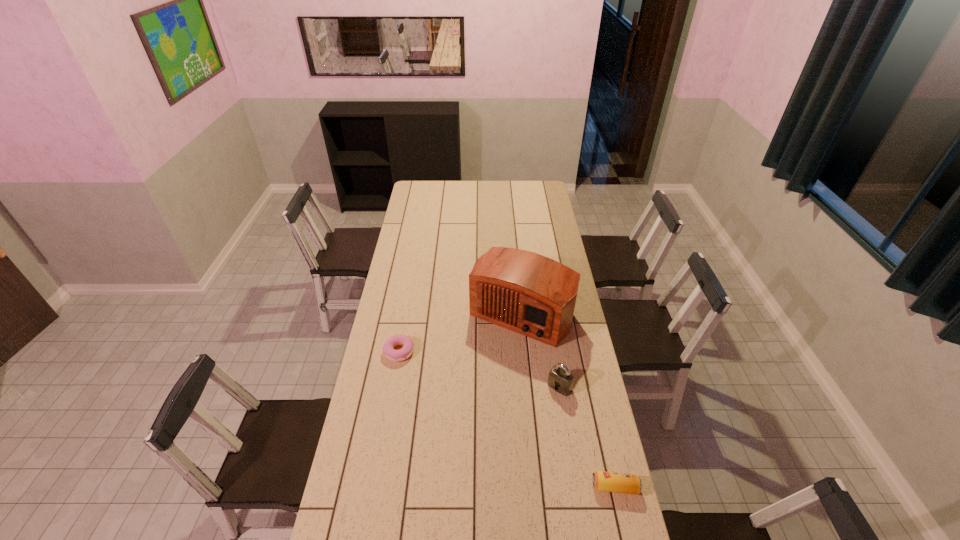
Identify the location of vacant space located on the front-facing side of the tallest object. The height and width of the screenshot is (540, 960). (470, 387).

At what (x,y) coordinates should I click in order to perform the action: click on free space located on the front-facing side of the tallest object. Please return your answer as a coordinate pair (x, y). The height and width of the screenshot is (540, 960). Looking at the image, I should click on (460, 405).

You are a GUI agent. You are given a task and a screenshot of the screen. Output one action in this format:
    pyautogui.click(x=<x>, y=<y>)
    Task: Click on the free space located at the front of the third shortest object near the keyhole
    This screenshot has width=960, height=540.
    Given the screenshot: What is the action you would take?
    pyautogui.click(x=532, y=419)

Locate an element on the screen. vacant area situated 0.210m at the front of the third shortest object near the keyhole is located at coordinates (520, 433).

The height and width of the screenshot is (540, 960). In order to click on vacant area situated at the front of the third shortest object near the keyhole in this screenshot , I will do `click(509, 447)`.

Find the location of `object that is at the left edge`. object that is at the left edge is located at coordinates [x=394, y=355].

This screenshot has height=540, width=960. I want to click on beer can present at the right edge, so click(x=603, y=481).

Where is `radio receiver that is at the right edge`? radio receiver that is at the right edge is located at coordinates (525, 292).

What are the coordinates of `padlock positioned at the right edge` in the screenshot? It's located at (560, 379).

Where is `free space at the far edge of the desktop`? The height and width of the screenshot is (540, 960). free space at the far edge of the desktop is located at coordinates (517, 196).